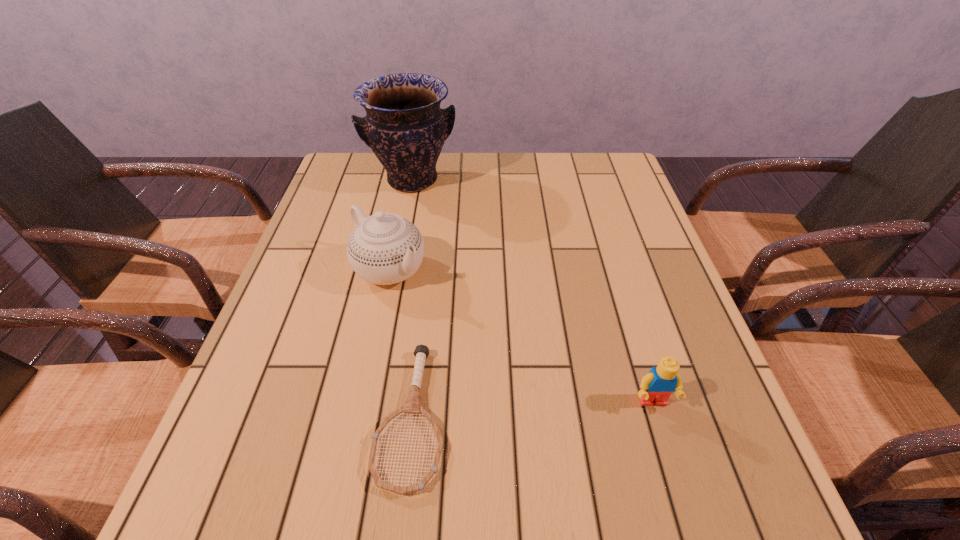
I want to click on the shortest object, so click(413, 406).

The image size is (960, 540). In order to click on the second shortest object in this screenshot , I will do pyautogui.click(x=656, y=387).

Image resolution: width=960 pixels, height=540 pixels. I want to click on Lego, so click(x=656, y=387).

The width and height of the screenshot is (960, 540). Identify the location of pottery. (405, 127).

Where is `the farthest object`? the farthest object is located at coordinates (405, 127).

This screenshot has height=540, width=960. In order to click on the third shortest object in this screenshot , I will do `click(384, 248)`.

You are a GUI agent. You are given a task and a screenshot of the screen. Output one action in this format:
    pyautogui.click(x=<x>, y=<y>)
    Task: Click on the chinaware
    
    Given the screenshot: What is the action you would take?
    pyautogui.click(x=384, y=248)

Find the location of a particular element. The height and width of the screenshot is (540, 960). free region located 0.240m on the left of the tennis racket is located at coordinates (246, 416).

Find the location of `free region located on the front handle of the tallest object`. free region located on the front handle of the tallest object is located at coordinates (446, 259).

Image resolution: width=960 pixels, height=540 pixels. Find the location of `vacant point located on the front handle of the tallest object`. vacant point located on the front handle of the tallest object is located at coordinates pos(428,215).